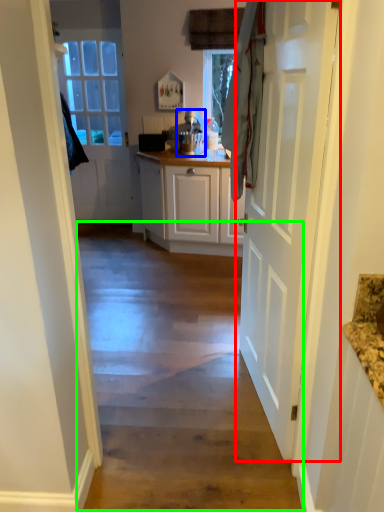
Question: Which object is positioned closest to door (highlighted by a red box)? Select from appliance (highlighted by a blue box) and path (highlighted by a green box).

Choices:
 (A) appliance
 (B) path

Answer: (B)